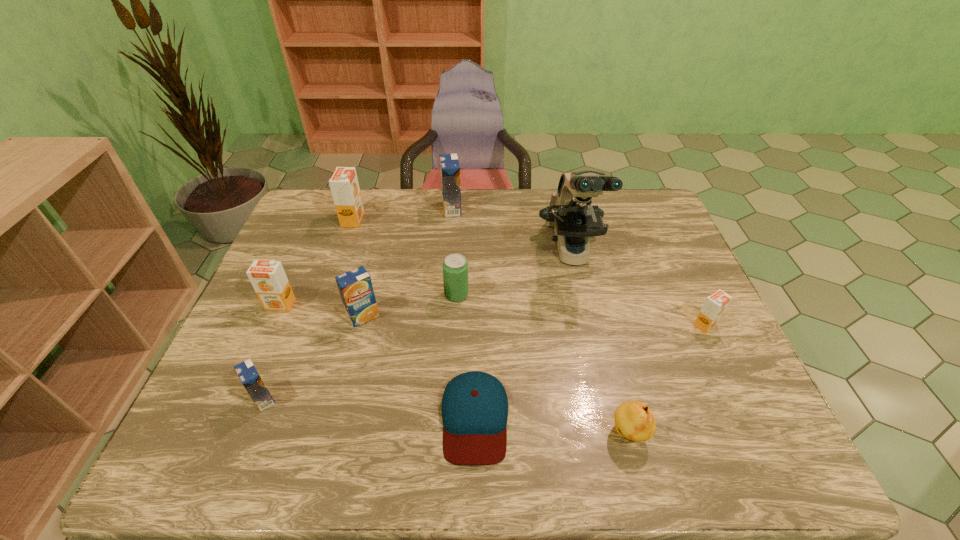
Find the location of `microscope`. microscope is located at coordinates (570, 211).

Identify the location of the rightmost blue orange_juice. (449, 165).

What are the coordinates of `the second orange juice from right to left` in the screenshot? It's located at (449, 165).

Where is `the second orange orange juice from left to right`? This screenshot has width=960, height=540. the second orange orange juice from left to right is located at coordinates (344, 185).

The width and height of the screenshot is (960, 540). In order to click on the farthest orange orange juice in this screenshot , I will do `click(344, 185)`.

The height and width of the screenshot is (540, 960). Identify the location of the fourth object from left to right. (355, 286).

Locate an element on the screen. the second nearest blue orange_juice is located at coordinates (355, 286).

Find the location of a particular element. Image resolution: width=960 pixels, height=540 pixels. the leftmost orange orange juice is located at coordinates (268, 278).

Image resolution: width=960 pixels, height=540 pixels. What are the coordinates of `the second smallest orange orange juice` in the screenshot? It's located at (268, 278).

I want to click on soda, so click(455, 267).